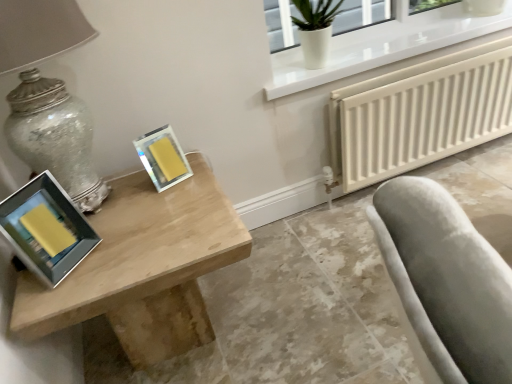
What are the coordinates of `vacant space to the right of matte glass table lamp at left` in the screenshot? It's located at (187, 208).